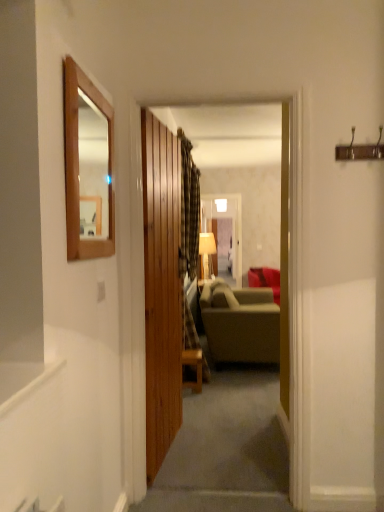
The image size is (384, 512). Identify the location of vacant area that lies to the right of plaid fabric curtain at center. (239, 380).